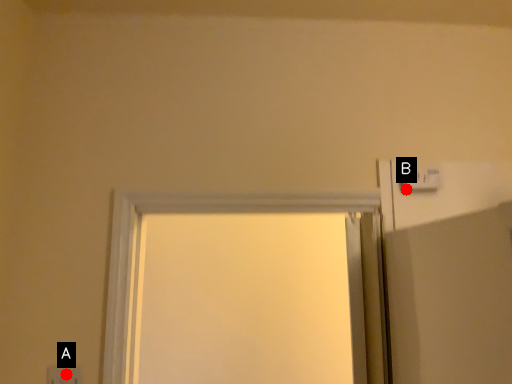
Question: Two points are circled on the image, labeled by A and B beside each circle. Which point appears farthest from the camera in this image?

Choices:
 (A) A is further
 (B) B is further

Answer: (B)